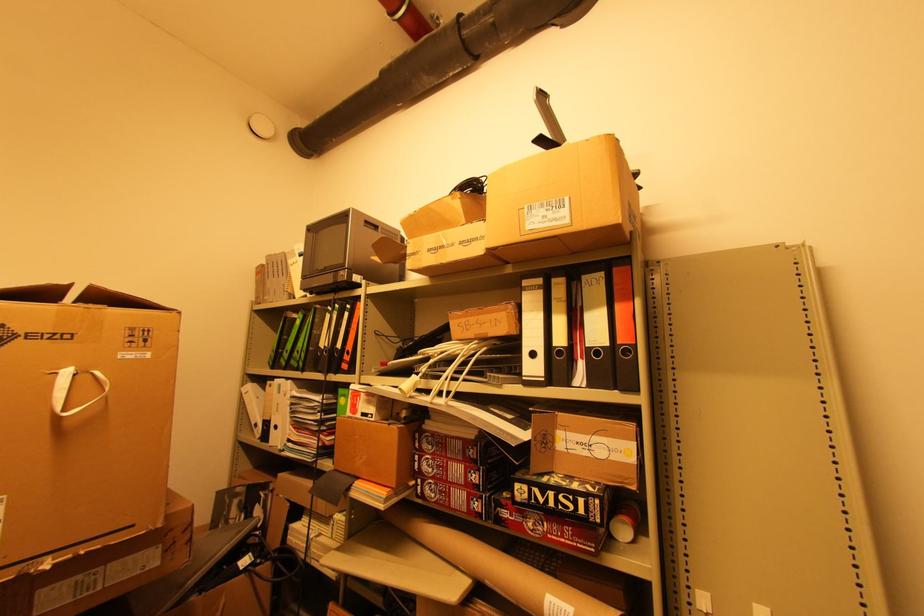
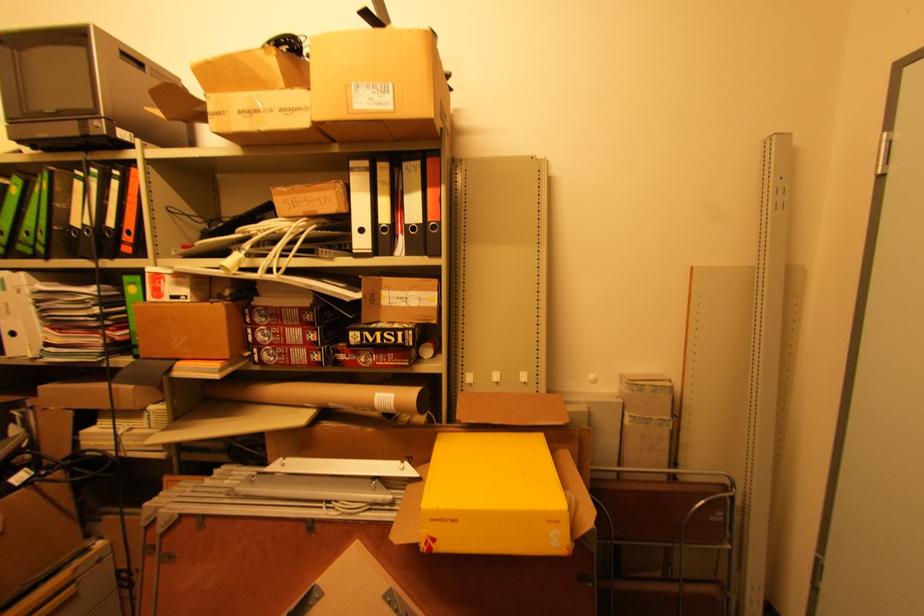
Find the pixel in the second image that matches point 558,345 in the first image.

(383, 223)